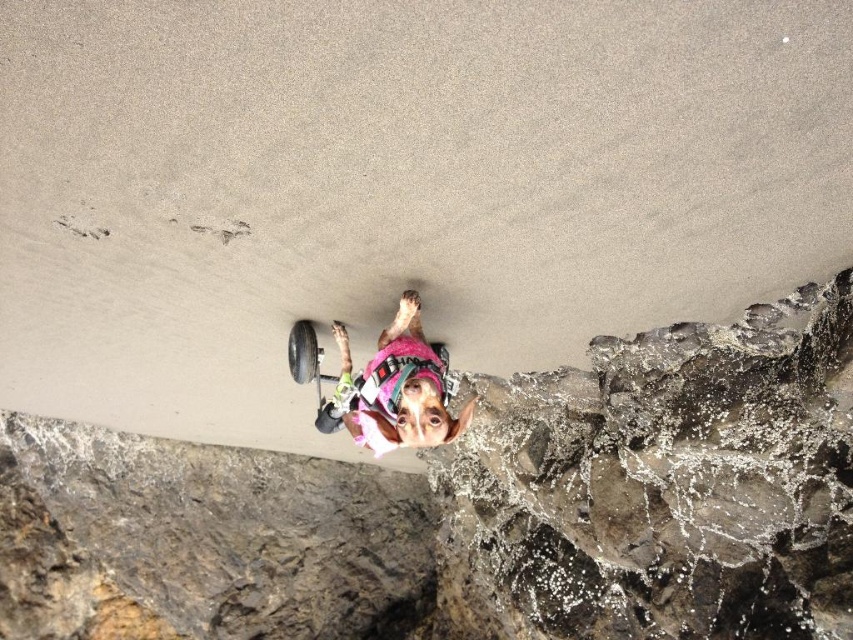
Consider the image. You are a photographer trying to capture the dog in the wheelchair. To ensure the rough stone wall at lower right is not in the frame, where should you position yourself relative to the dog?

To avoid including the rough stone wall at lower right in the frame, position yourself to the left of the dog since the wall is located at the lower right point of the image.

You are a photographer setting up a shot of the pink fabric dog at center and the rough stone wall at lower right. Which object should you focus on first if you want to capture both in the frame without moving the camera?

The rough stone wall at lower right is larger in size than the pink fabric dog at center, so you should focus on the larger rough stone wall at lower right first to ensure it fits well in the frame before adjusting for the smaller pink fabric dog at center.